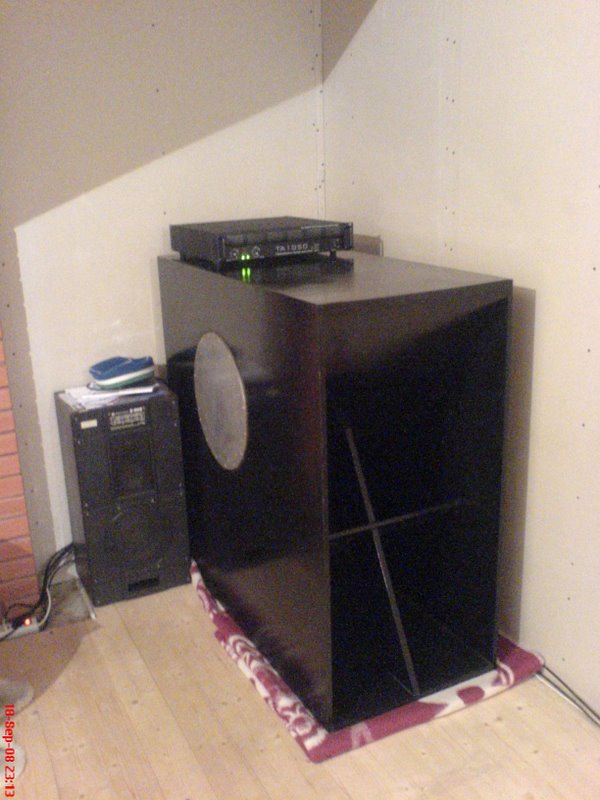
Image resolution: width=600 pixels, height=800 pixels. What are the coordinates of `modem` in the screenshot? It's located at (287, 242).